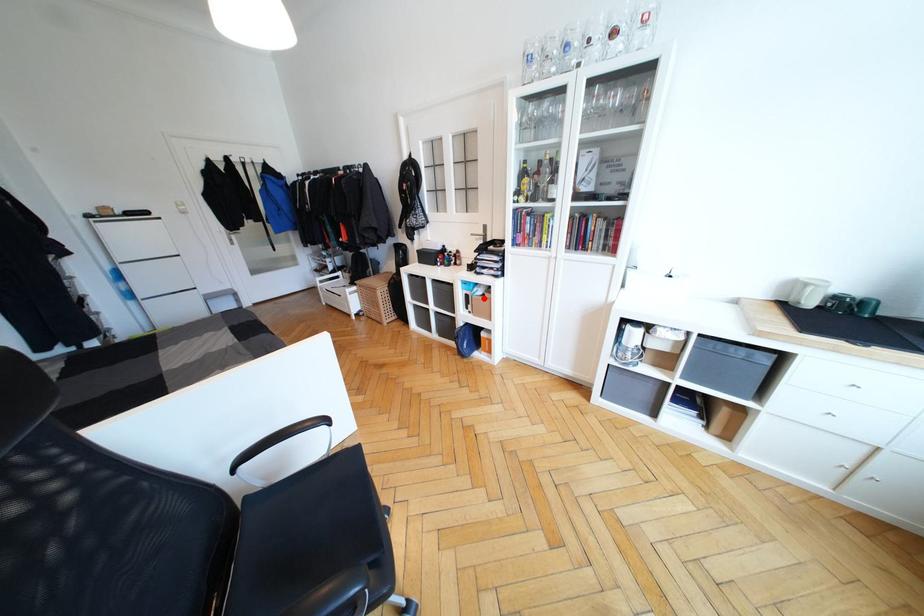
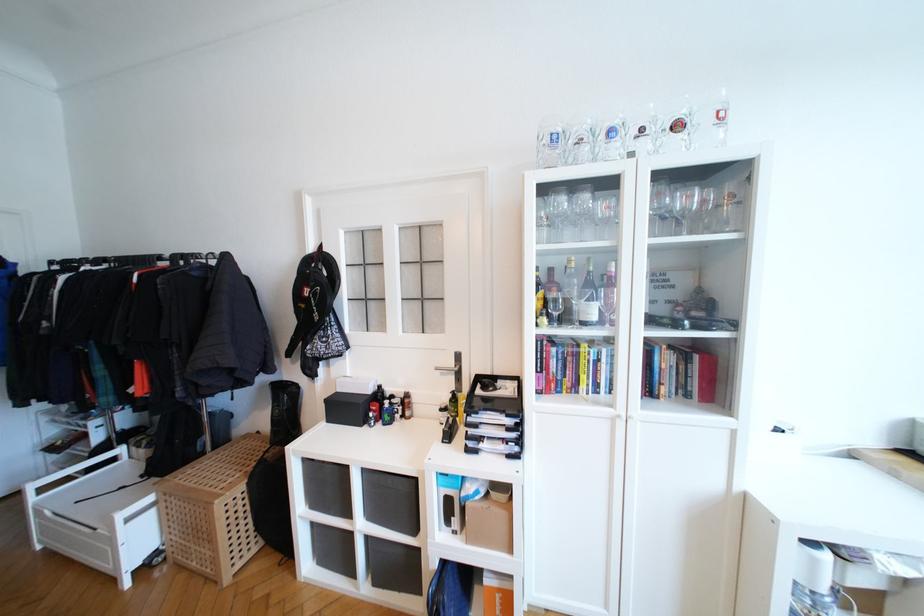
In the second image, find the point that corresponds to the highlighted location in the first image.

(489, 506)